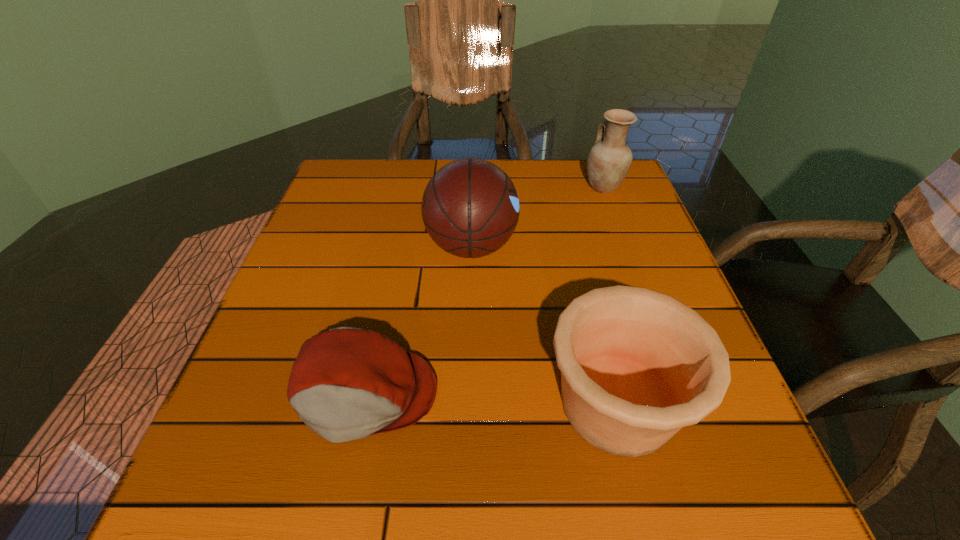
Find the location of a particular element. The width and height of the screenshot is (960, 540). free space that satisfies the following two spatial constraints: 1. on the front-facing side of the cap; 2. on the left side of the shorter pottery is located at coordinates (364, 403).

You are a GUI agent. You are given a task and a screenshot of the screen. Output one action in this format:
    pyautogui.click(x=<x>, y=<y>)
    Task: Click on the free point that satisfies the following two spatial constraints: 1. on the front-facing side of the second shortest object; 2. on the right side of the cap
    This screenshot has height=540, width=960.
    Given the screenshot: What is the action you would take?
    pyautogui.click(x=364, y=403)

At what (x,y) coordinates should I click in order to perform the action: click on vacant space that satisfies the following two spatial constraints: 1. on the back side of the third tallest object; 2. on the right side of the taller pottery. Please return your answer as a coordinate pair (x, y). This screenshot has width=960, height=540. Looking at the image, I should click on (564, 187).

Identify the location of vacant area in the image that satisfies the following two spatial constraints: 1. on the front side of the nearer pottery; 2. on the left side of the second farthest object. pos(468,403).

Identify the location of vacant space that satisfies the following two spatial constraints: 1. on the front-facing side of the nearer pottery; 2. on the left side of the cap. The image size is (960, 540). (364, 403).